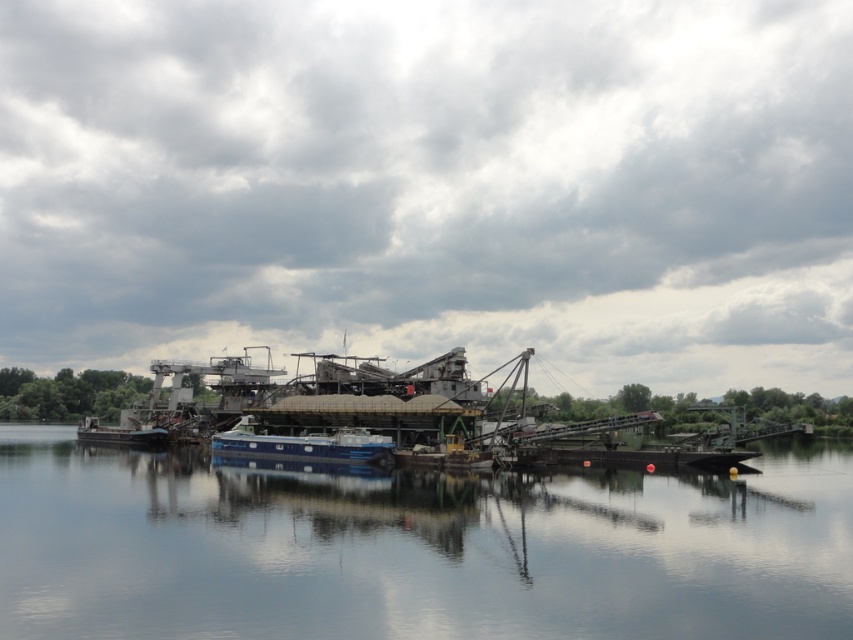
Is point (305, 493) positioned in front of point (131, 435)?

That is True.

Does point (57, 438) come farther from viewer compared to point (142, 436)?

Yes, point (57, 438) is farther from viewer.

In order to click on smooth blue water at center in this screenshot , I will do `click(415, 548)`.

At what (x,y) coordinates should I click in order to perform the action: click on smooth blue water at center. Please return your answer as a coordinate pair (x, y). The height and width of the screenshot is (640, 853). Looking at the image, I should click on pyautogui.click(x=415, y=548).

Is blue matte boat at center below blue metallic barge at center?

No, blue matte boat at center is not below blue metallic barge at center.

Is blue matte boat at center to the left of blue metallic barge at center from the viewer's perspective?

In fact, blue matte boat at center is to the right of blue metallic barge at center.

Does point (328, 470) lie behind point (125, 440)?

No, it is in front of (125, 440).

Identify the location of blue matte boat at center. The image size is (853, 640). (305, 449).

The width and height of the screenshot is (853, 640). I want to click on smooth blue water at center, so click(x=415, y=548).

The width and height of the screenshot is (853, 640). I want to click on smooth blue water at center, so (415, 548).